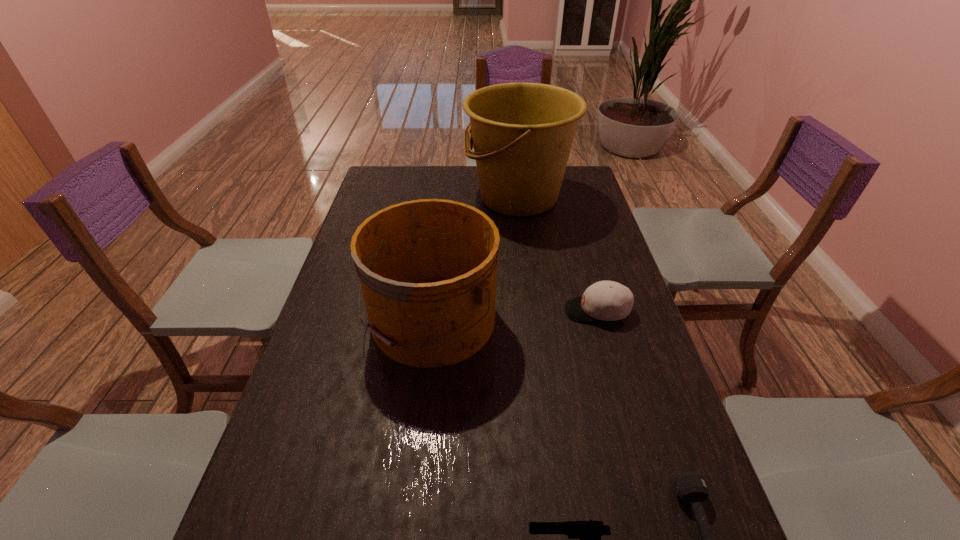
The image size is (960, 540). What are the coordinates of `the taller bucket` in the screenshot? It's located at (522, 132).

Where is `the farther bucket`? This screenshot has height=540, width=960. the farther bucket is located at coordinates (522, 132).

The image size is (960, 540). I want to click on the second tallest object, so click(427, 268).

The width and height of the screenshot is (960, 540). In order to click on the nearer bucket in this screenshot , I will do `click(427, 268)`.

Locate an element on the screen. This screenshot has height=540, width=960. baseball cap is located at coordinates (605, 300).

Locate an element on the screen. This screenshot has width=960, height=540. free location located 0.130m on the side of the farthest object with the handle is located at coordinates (431, 198).

This screenshot has width=960, height=540. I want to click on free location located 0.350m on the side of the farthest object with the handle, so click(x=374, y=198).

At what (x,y) coordinates should I click in order to perform the action: click on vacant space located on the side of the farthest object with the handle. Please return your answer as a coordinate pair (x, y). Image resolution: width=960 pixels, height=540 pixels. Looking at the image, I should click on (413, 198).

Where is `free region located on the right of the nearer bucket`? free region located on the right of the nearer bucket is located at coordinates (526, 320).

The image size is (960, 540). I want to click on free location located on the front-facing side of the baseball cap, so click(474, 310).